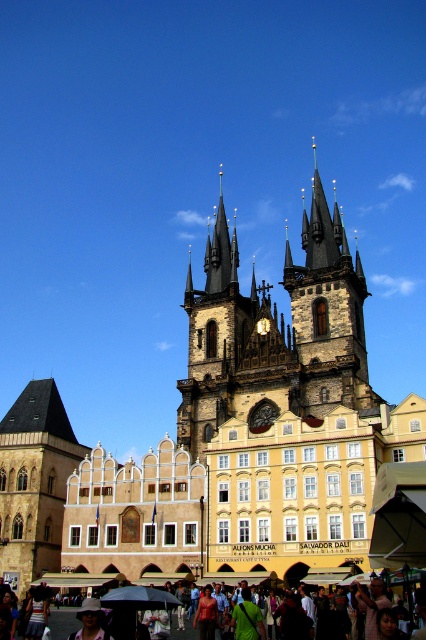
You are an architect designing a new plaza in front of the brown stone church at center and the matte black umbrella at lower center. To ensure the plaza accommodates both structures, which structure requires a wider space allocation?

The brown stone church at center requires a wider space allocation because its width is larger than the matte black umbrella at lower center.

You are standing in front of the historic Gothic Revival building with the clock face. There are two points marked on the scene at coordinates point (317, 216) and point (49, 620). Which point is closer to you?

Point (317, 216) is further to the viewer than point (49, 620), so the point closer to you is point (49, 620).

You are an architect designing a new building that needs to fit between the brown stone clock tower at center and the matte black umbrella at lower center. Based on their widths, can you determine if there is enough space for your new structure?

The brown stone clock tower at center might be wider than matte black umbrella at lower center, so there is uncertainty about the available space between them. Further measurements would be needed to confirm if the new structure can fit.